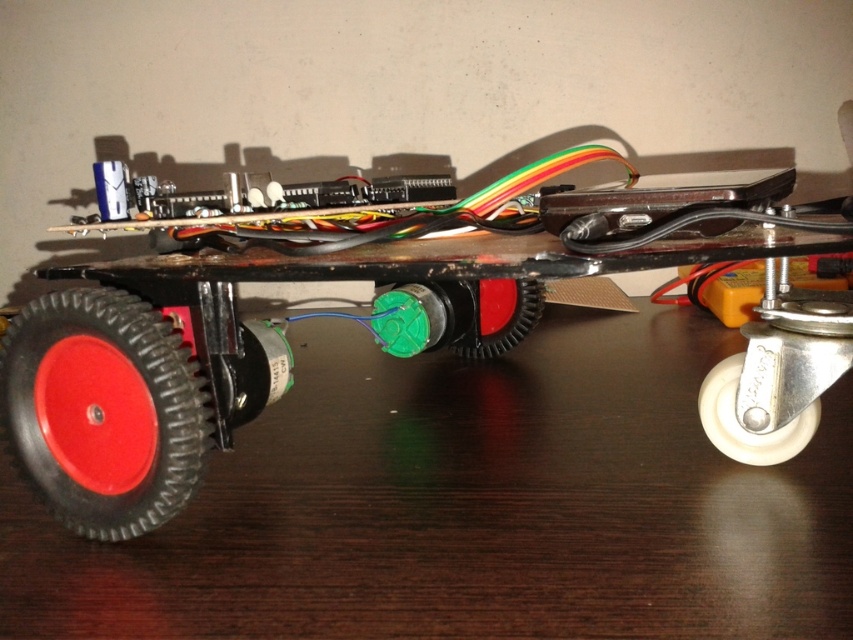
Question: Which point is farther to the camera?

Choices:
 (A) (540, 291)
 (B) (80, 320)

Answer: (A)

Question: Which point is farther from the camera taking this photo?

Choices:
 (A) (511, 296)
 (B) (79, 410)

Answer: (A)

Question: Where is rubberized black toy car at center located in relation to white rubber wheel at lower right in the image?

Choices:
 (A) below
 (B) above

Answer: (B)

Question: Estimate the real-world distances between objects in this image. Which object is farther from the rubberized black toy car at center?

Choices:
 (A) rubber/textured wheel at lower left
 (B) green rubber wheel at center
 (C) white rubber wheel at lower right

Answer: (B)

Question: Considering the relative positions of rubber/textured wheel at lower left and green rubber wheel at center in the image provided, where is rubber/textured wheel at lower left located with respect to green rubber wheel at center?

Choices:
 (A) right
 (B) left

Answer: (B)

Question: Is rubberized black toy car at center bigger than rubber/textured wheel at lower left?

Choices:
 (A) yes
 (B) no

Answer: (A)